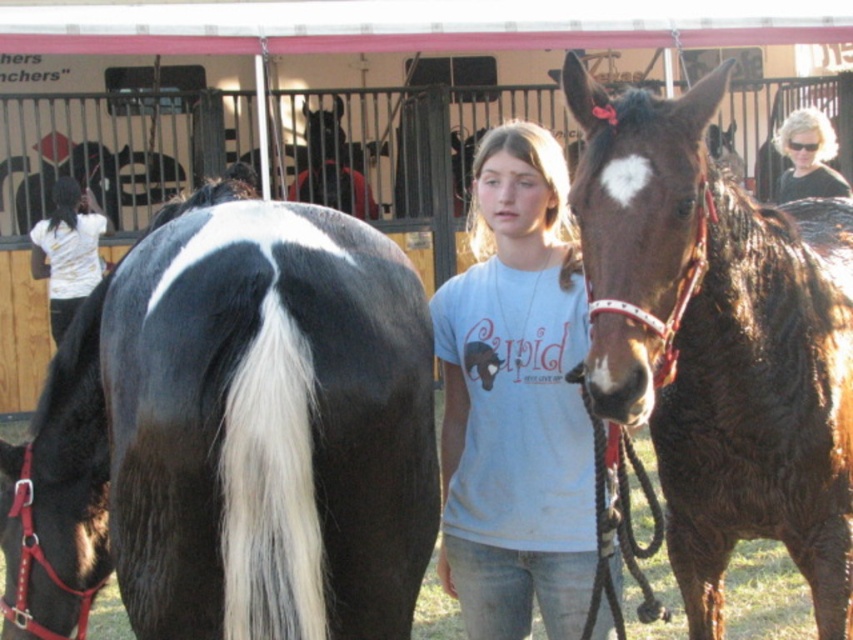
Question: Which object is farther from the camera taking this photo?

Choices:
 (A) white shirt at left
 (B) black glossy horse at center

Answer: (A)

Question: Which point is closer to the camera?

Choices:
 (A) light blue cotton shirt at center
 (B) blonde hair at upper right
 (C) black glossy horse at center
 (D) brown glossy horse at center

Answer: (C)

Question: Does black glossy horse at center have a greater width compared to white shirt at left?

Choices:
 (A) no
 (B) yes

Answer: (B)

Question: Which object is the closest to the black glossy horse at center?

Choices:
 (A) blonde hair at upper right
 (B) white shirt at left
 (C) brown glossy horse at center

Answer: (C)

Question: Observing the image, what is the correct spatial positioning of black glossy horse at center in reference to white shirt at left?

Choices:
 (A) left
 (B) right

Answer: (B)

Question: Can you confirm if light blue cotton shirt at center is positioned to the right of white shirt at left?

Choices:
 (A) yes
 (B) no

Answer: (A)